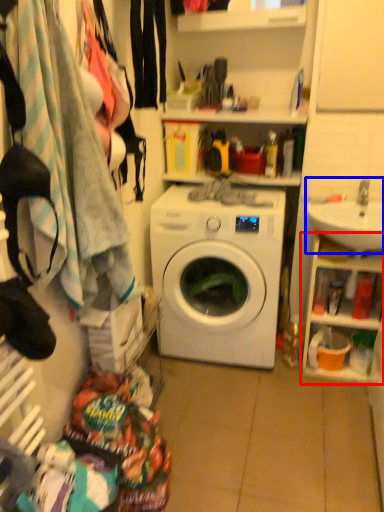
Question: Which object is further to the camera taking this photo, cabinet (highlighted by a red box) or sink (highlighted by a blue box)?

Choices:
 (A) cabinet
 (B) sink

Answer: (A)